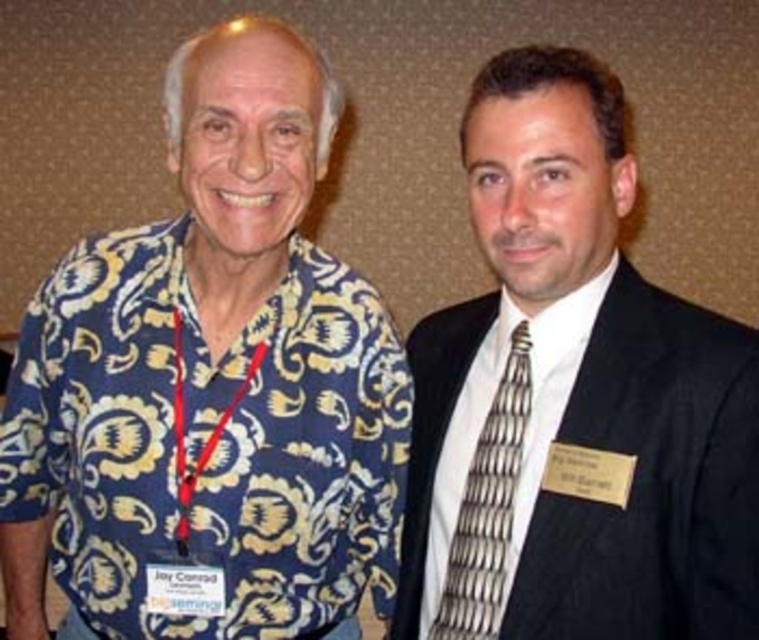
Does blue floral shirt at left have a greater width compared to black suit at right?

Correct, the width of blue floral shirt at left exceeds that of black suit at right.

Which is more to the right, blue floral shirt at left or black suit at right?

From the viewer's perspective, black suit at right appears more on the right side.

Which is in front, point (95, 406) or point (446, 577)?

Point (95, 406)

Where is `blue floral shirt at left`? The width and height of the screenshot is (759, 640). blue floral shirt at left is located at coordinates 210,387.

Which is below, blue floral shirt at left or silver metallic tie at right?

Positioned lower is silver metallic tie at right.

What do you see at coordinates (210, 387) in the screenshot? I see `blue floral shirt at left` at bounding box center [210, 387].

Who is more distant from viewer, (43, 349) or (446, 628)?

The point (43, 349) is more distant.

This screenshot has height=640, width=759. What are the coordinates of `blue floral shirt at left` in the screenshot? It's located at (210, 387).

Is black suit at right taller than silver metallic tie at right?

Indeed, black suit at right has a greater height compared to silver metallic tie at right.

Does black suit at right appear under silver metallic tie at right?

No.

Does point (471, 570) come behind point (512, 451)?

Yes, it is behind point (512, 451).

Find the location of a particular element. The image size is (759, 640). black suit at right is located at coordinates (572, 400).